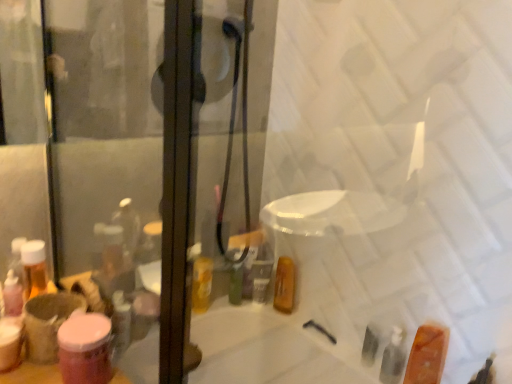
Question: Is pink matte jar at lower left, marked as the 2th toiletry in a bottom-to-top arrangement, positioned with its back to translucent orange soap at lower right, arranged as the first toiletry when ordered from the bottom?

Choices:
 (A) yes
 (B) no

Answer: (B)

Question: Can you confirm if pink matte jar at lower left, which ranks as the 1th toiletry in top-to-bottom order, is positioned to the right of translucent orange soap at lower right, the 1th toiletry viewed from the right?

Choices:
 (A) yes
 (B) no

Answer: (B)

Question: Can you confirm if pink matte jar at lower left, acting as the first toiletry starting from the left, is thinner than translucent orange soap at lower right, the 2th toiletry viewed from the front?

Choices:
 (A) no
 (B) yes

Answer: (B)

Question: Can you confirm if pink matte jar at lower left, acting as the first toiletry starting from the left, is positioned to the left of translucent orange soap at lower right, the 2th toiletry viewed from the front?

Choices:
 (A) no
 (B) yes

Answer: (B)

Question: From a real-world perspective, is pink matte jar at lower left, the 2th toiletry from the back, located beneath translucent orange soap at lower right, arranged as the first toiletry when ordered from the bottom?

Choices:
 (A) yes
 (B) no

Answer: (B)

Question: Is pink matte jar at lower left, the 2th toiletry from the back, smaller than translucent orange soap at lower right, arranged as the first toiletry when viewed from the back?

Choices:
 (A) yes
 (B) no

Answer: (A)

Question: From the image's perspective, is translucent orange soap at lower right, arranged as the first toiletry when ordered from the bottom, under pink matte jar at lower left, which ranks as the 1th toiletry in top-to-bottom order?

Choices:
 (A) yes
 (B) no

Answer: (A)

Question: Could you tell me if translucent orange soap at lower right, arranged as the first toiletry when ordered from the bottom, is turned towards pink matte jar at lower left, the 2th toiletry from the back?

Choices:
 (A) no
 (B) yes

Answer: (A)

Question: Considering the relative positions of translucent orange soap at lower right, the 1th toiletry viewed from the right, and pink matte jar at lower left, which appears as the second toiletry when viewed from the right, in the image provided, is translucent orange soap at lower right, the 1th toiletry viewed from the right, to the left of pink matte jar at lower left, which appears as the second toiletry when viewed from the right, from the viewer's perspective?

Choices:
 (A) no
 (B) yes

Answer: (A)

Question: Would you consider translucent orange soap at lower right, arranged as the first toiletry when ordered from the bottom, to be distant from pink matte jar at lower left, the first toiletry when ordered from front to back?

Choices:
 (A) no
 (B) yes

Answer: (A)

Question: From a real-world perspective, is translucent orange soap at lower right, placed as the 2th toiletry when sorted from top to bottom, on top of pink matte jar at lower left, acting as the first toiletry starting from the left?

Choices:
 (A) no
 (B) yes

Answer: (A)

Question: From a real-world perspective, is translucent orange soap at lower right, arranged as the first toiletry when viewed from the back, below pink matte jar at lower left, the first toiletry when ordered from front to back?

Choices:
 (A) no
 (B) yes

Answer: (B)

Question: Relative to pink matte jar at lower left, the first toiletry when ordered from front to back, is translucent orange soap at lower right, the 2th toiletry viewed from the front, in front or behind?

Choices:
 (A) front
 (B) behind

Answer: (B)